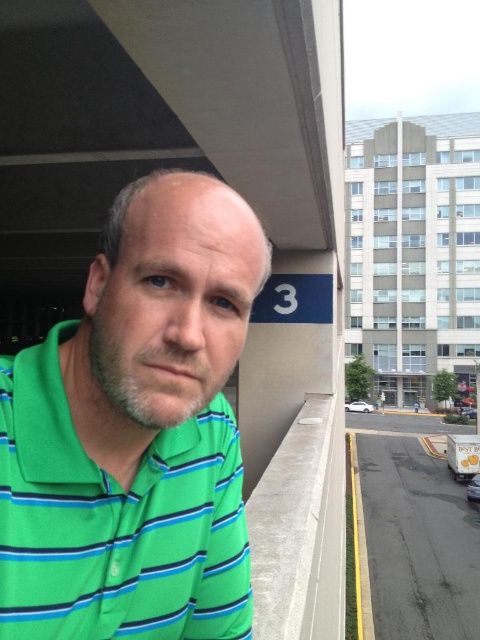
Does white glossy van at lower right have a greater height compared to white matte car at lower right?

Yes, white glossy van at lower right is taller than white matte car at lower right.

The height and width of the screenshot is (640, 480). Identify the location of white glossy van at lower right. (474, 488).

Image resolution: width=480 pixels, height=640 pixels. Identify the location of white glossy van at lower right. (474, 488).

Is green striped polo shirt at left to the right of white matte car at lower right from the viewer's perspective?

In fact, green striped polo shirt at left is to the left of white matte car at lower right.

Between point (94, 330) and point (354, 403), which one is positioned in front?

Point (94, 330) is in front.

Does point (28, 464) come farther from viewer compared to point (345, 404)?

No, it is in front of (345, 404).

This screenshot has height=640, width=480. Find the location of `green striped polo shirt at left`. green striped polo shirt at left is located at coordinates (134, 433).

Who is taller, green striped polo shirt at left or white glossy van at lower right?

With more height is white glossy van at lower right.

Is point (145, 435) positioned in front of point (475, 500)?

Yes, point (145, 435) is in front of point (475, 500).

This screenshot has height=640, width=480. Find the location of `green striped polo shirt at left`. green striped polo shirt at left is located at coordinates (134, 433).